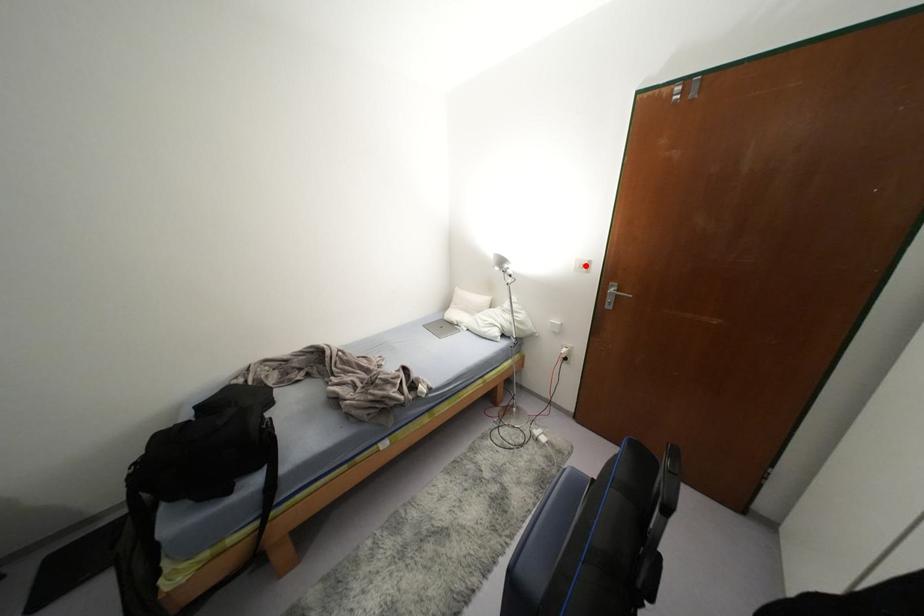
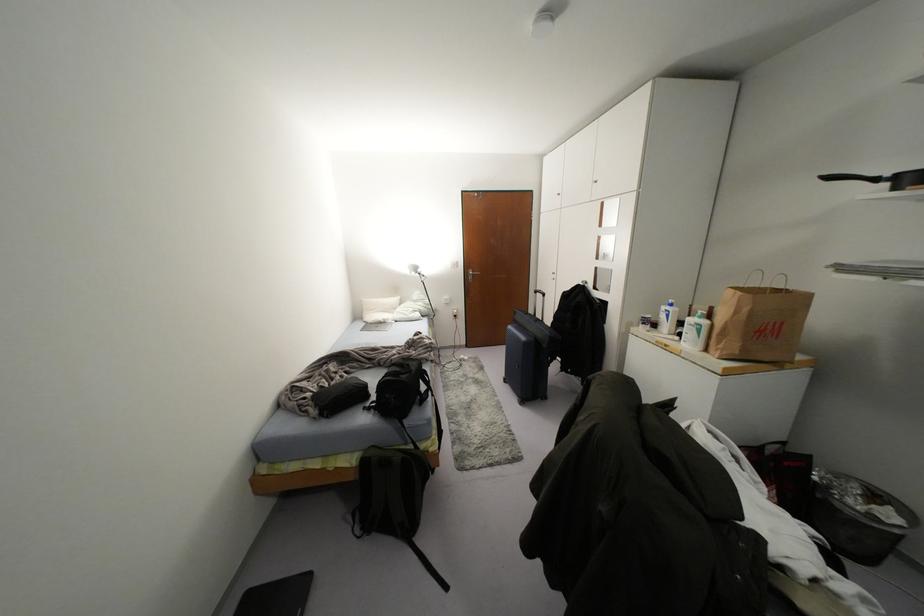
Question: I am providing you with two images of the same scene from different viewpoints. A red point is shown in image1. For the corresponding object point in image2, is it positioned nearer or farther from the camera?

Choices:
 (A) Nearer
 (B) Farther

Answer: (B)